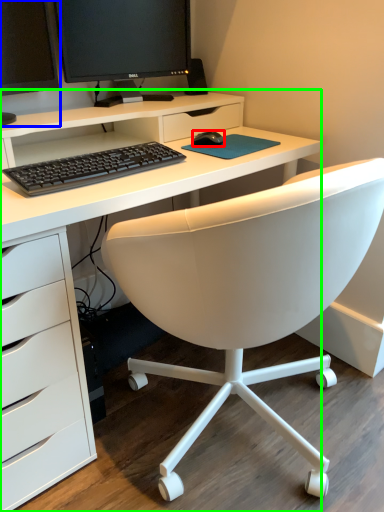
Question: Considering the real-world distances, which object is closest to mouse (highlighted by a red box)? computer monitor (highlighted by a blue box) or desk (highlighted by a green box).

Choices:
 (A) computer monitor
 (B) desk

Answer: (B)